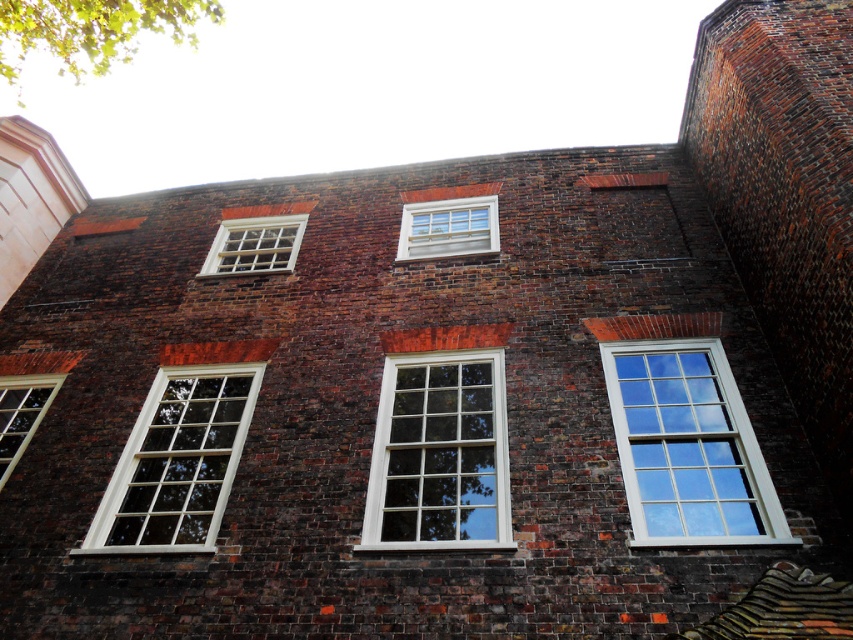
You are standing in front of the brick building and see a point marked at coordinates (688,445). Based on the scene description, can you determine which object this point is located on?

The point at coordinates (688,445) is located on the white wood window at right.

Consider the image. You are an architect assessing the brick building. You notice the white wood window at right and the white wooden window at upper center. Which window has a greater height?

The white wood window at right is much taller than the white wooden window at upper center, so it has a greater height.

You are standing in front of the brick building and want to locate the white wood window at right. According to the coordinates provided, where would you look relative to the center of the building?

The white wood window at right is located at point (688, 445), which is to the right and slightly above the center of the building.